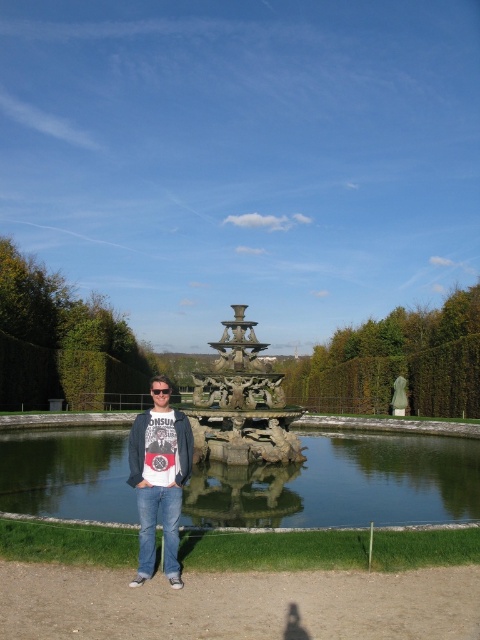
Question: Observing the image, what is the correct spatial positioning of bronze sculpture at center in reference to white cotton t-shirt at center?

Choices:
 (A) right
 (B) left

Answer: (A)

Question: Can you confirm if bronze sculpture at center is positioned to the right of white cotton t-shirt at center?

Choices:
 (A) yes
 (B) no

Answer: (A)

Question: Which point is farther to the camera?

Choices:
 (A) (267, 408)
 (B) (144, 524)
 (C) (188, 456)

Answer: (A)

Question: Which object is the closest to the clear glass water at center?

Choices:
 (A) white cotton t-shirt at center
 (B) denim jacket at center

Answer: (A)

Question: Among these objects, which one is nearest to the camera?

Choices:
 (A) white cotton t-shirt at center
 (B) denim jacket at center
 (C) clear glass water at center
 (D) bronze sculpture at center

Answer: (B)

Question: Is clear glass water at center to the right of denim jacket at center from the viewer's perspective?

Choices:
 (A) yes
 (B) no

Answer: (A)